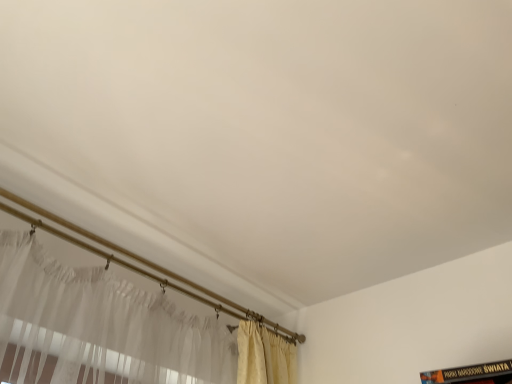
The width and height of the screenshot is (512, 384). Find the location of `white sheer curtain at lower left`. white sheer curtain at lower left is located at coordinates (118, 328).

The height and width of the screenshot is (384, 512). Describe the element at coordinates (118, 328) in the screenshot. I see `white sheer curtain at lower left` at that location.

In order to face black matte book at lower right, should I rotate leftwards or rightwards?

Turn right by 28.141 degrees to look at black matte book at lower right.

What do you see at coordinates (471, 374) in the screenshot? This screenshot has height=384, width=512. I see `black matte book at lower right` at bounding box center [471, 374].

Identify the location of black matte book at lower right. This screenshot has width=512, height=384. (471, 374).

Identify the location of white sheer curtain at lower left. (118, 328).

Which is more to the right, black matte book at lower right or white sheer curtain at lower left?

Positioned to the right is black matte book at lower right.

Which object is further away from the camera, black matte book at lower right or white sheer curtain at lower left?

white sheer curtain at lower left is more distant.

Which is closer, (445, 376) or (137, 342)?

The point (137, 342) is more forward.

From the image's perspective, which one is positioned higher, black matte book at lower right or white sheer curtain at lower left?

white sheer curtain at lower left is shown above in the image.

From a real-world perspective, which is physically below, black matte book at lower right or white sheer curtain at lower left?

black matte book at lower right, from a real-world perspective.

Can you confirm if black matte book at lower right is thinner than white sheer curtain at lower left?

In fact, black matte book at lower right might be wider than white sheer curtain at lower left.

In the scene shown: Considering the sizes of objects black matte book at lower right and white sheer curtain at lower left in the image provided, who is taller, black matte book at lower right or white sheer curtain at lower left?

Standing taller between the two is black matte book at lower right.

Can you confirm if black matte book at lower right is bigger than white sheer curtain at lower left?

No.

Is black matte book at lower right situated inside white sheer curtain at lower left or outside?

black matte book at lower right is spatially situated outside white sheer curtain at lower left.

Is black matte book at lower right touching white sheer curtain at lower left?

black matte book at lower right and white sheer curtain at lower left are clearly separated.

Is black matte book at lower right oriented away from white sheer curtain at lower left?

black matte book at lower right does not have its back to white sheer curtain at lower left.

How much distance is there between black matte book at lower right and white sheer curtain at lower left?

black matte book at lower right is 96.93 centimeters away from white sheer curtain at lower left.

Find the location of a particular element. This screenshot has height=384, width=512. curtain above the black matte book at lower right (from the image's perspective) is located at coordinates (118, 328).

Which is more to the left, white sheer curtain at lower left or black matte book at lower right?

white sheer curtain at lower left is more to the left.

Which object is more forward, white sheer curtain at lower left or black matte book at lower right?

Positioned in front is black matte book at lower right.

Is point (212, 364) positioned behind point (484, 374)?

That is True.

From the image's perspective, would you say white sheer curtain at lower left is positioned over black matte book at lower right?

Yes, from the image's perspective, white sheer curtain at lower left is over black matte book at lower right.

From a real-world perspective, is white sheer curtain at lower left physically below black matte book at lower right?

Actually, white sheer curtain at lower left is physically above black matte book at lower right in the real world.

Does white sheer curtain at lower left have a lesser width compared to black matte book at lower right?

Indeed, white sheer curtain at lower left has a lesser width compared to black matte book at lower right.

Which of these two, white sheer curtain at lower left or black matte book at lower right, stands shorter?

With less height is white sheer curtain at lower left.

Is white sheer curtain at lower left bigger than black matte book at lower right?

Yes.

Is white sheer curtain at lower left inside or outside of black matte book at lower right?

white sheer curtain at lower left cannot be found inside black matte book at lower right.

Is the surface of white sheer curtain at lower left in direct contact with black matte book at lower right?

There is a gap between white sheer curtain at lower left and black matte book at lower right.

Is white sheer curtain at lower left facing towards black matte book at lower right?

No, white sheer curtain at lower left is not aimed at black matte book at lower right.

Can you tell me how much white sheer curtain at lower left and black matte book at lower right differ in facing direction?

79.6 degrees.

How much distance is there between white sheer curtain at lower left and black matte book at lower right?

white sheer curtain at lower left and black matte book at lower right are 38.16 inches apart.

Find the location of a particular element. This screenshot has height=384, width=512. book beneath the white sheer curtain at lower left (from a real-world perspective) is located at coordinates (471, 374).

Identify the location of curtain that is above the black matte book at lower right (from a real-world perspective). The image size is (512, 384). (118, 328).

I want to click on book to the right of white sheer curtain at lower left, so click(x=471, y=374).